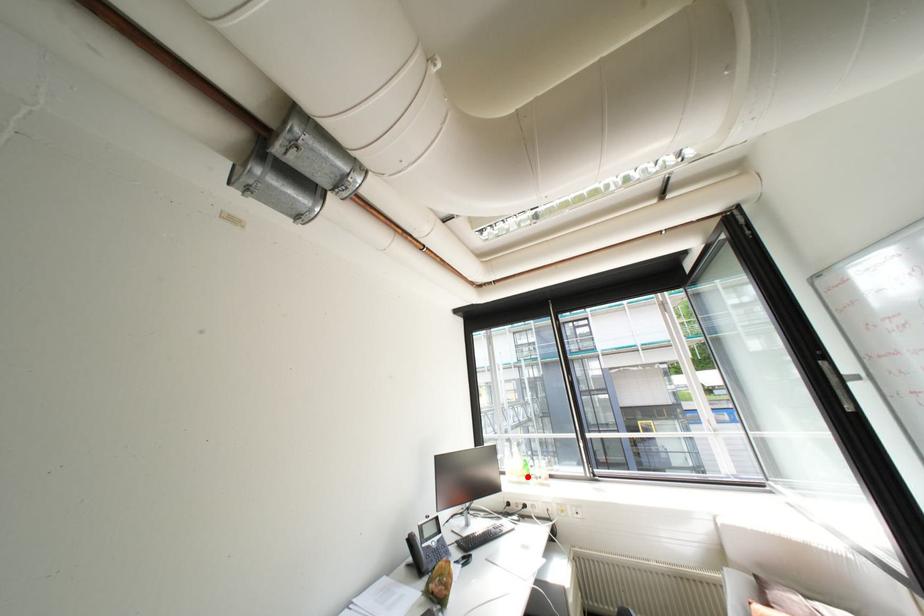
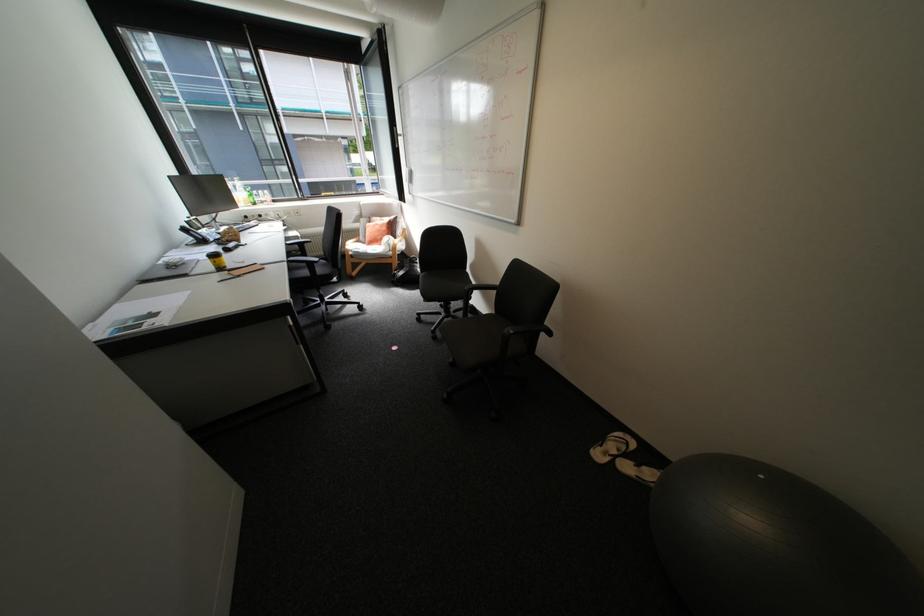
Question: I am providing you with two images of the same scene from different viewpoints. Image1 has a red point marked. In image2, the corresponding 3D location appears at what relative position? Reply with the corresponding letter.

Choices:
 (A) Closer
 (B) Farther

Answer: (A)